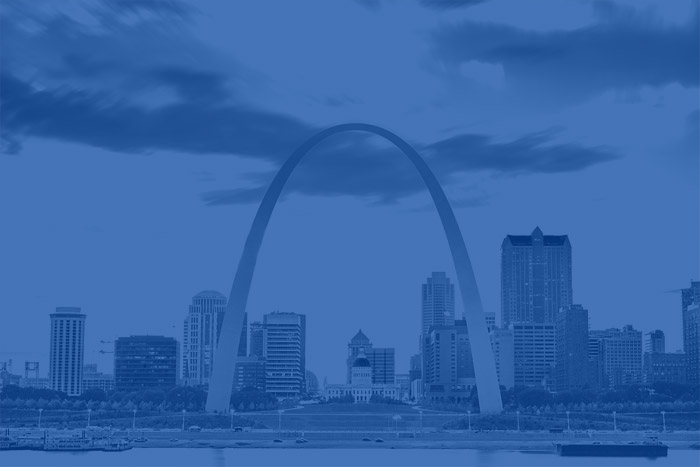
The image size is (700, 467). I want to click on left side of arch, so click(x=236, y=297).